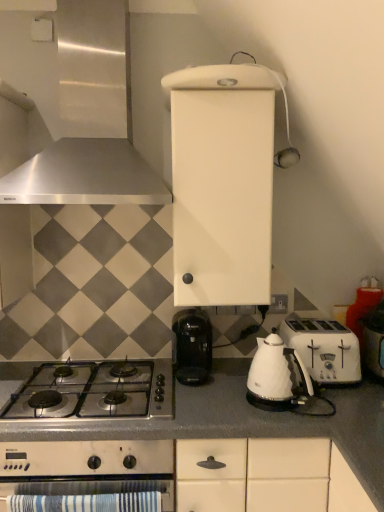
The image size is (384, 512). What are the coordinates of `free location to the right of white glossy kettle at lower center` in the screenshot? It's located at (330, 406).